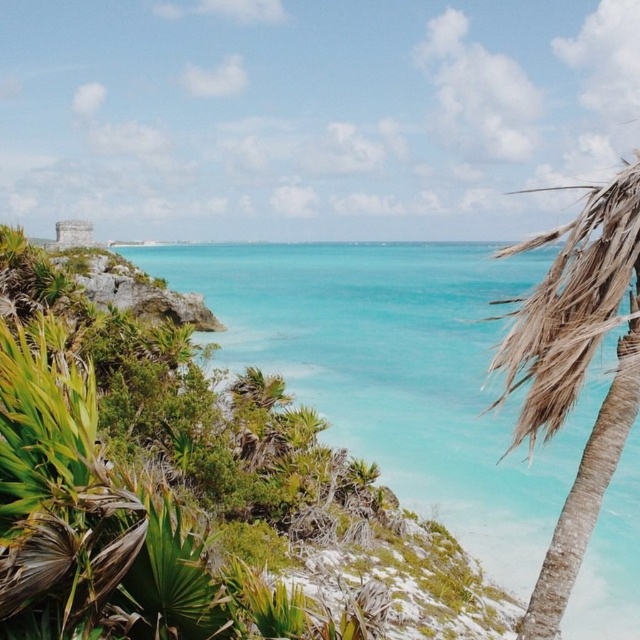
You are standing at the point marked by the coordinate point at center which is point (401, 371). You want to walk towards the rocky cliffs. Which direction should you head?

The rocky cliffs are located behind the turquoise water at center, so you should head north.

You are standing on the rocky cliff edge and want to take a photo of the turquoise water at center without the brown textured palm tree at right blocking the view. Is the palm tree currently obscuring the water?

The turquoise water at center is positioned under the brown textured palm tree at right, so the palm tree is blocking the view of the water.